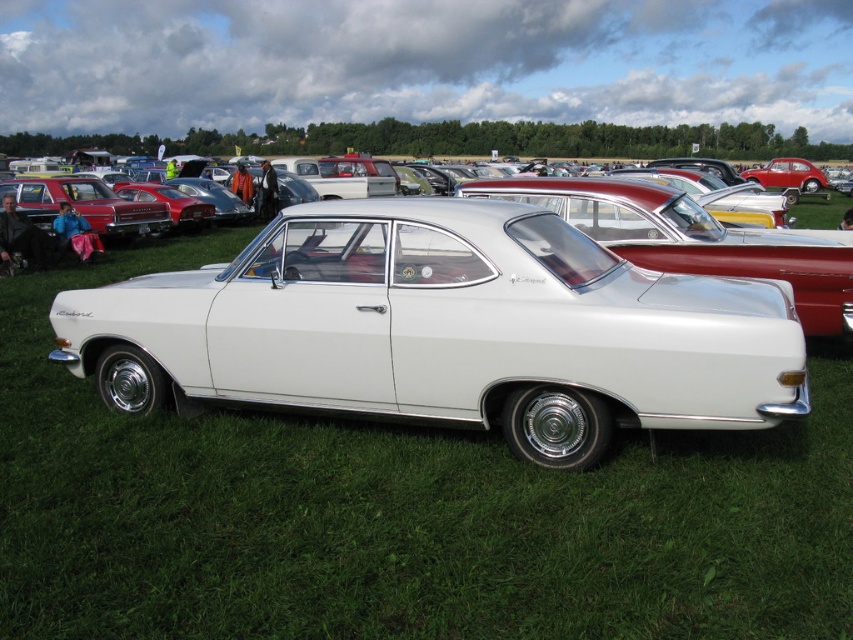
Based on the photo, can you confirm if white glossy car at center is wider than white glossy sedan at center?

Yes.

Between point (242, 276) and point (653, 212), which one is positioned behind?

Positioned behind is point (653, 212).

At what (x,y) coordinates should I click in order to perform the action: click on white glossy car at center. Please return your answer as a coordinate pair (x, y). This screenshot has width=853, height=640. Looking at the image, I should click on (445, 328).

Can you confirm if matte red car at left is positioned above shiny red car at center?

No, matte red car at left is not above shiny red car at center.

Who is more distant from viewer, (132, 202) or (776, 176)?

The point (776, 176) is behind.

Image resolution: width=853 pixels, height=640 pixels. Find the location of `matte red car at left`. matte red car at left is located at coordinates (90, 204).

Can you confirm if white glossy sedan at center is positioned above shiny red car at center?

Actually, white glossy sedan at center is below shiny red car at center.

The height and width of the screenshot is (640, 853). Describe the element at coordinates (689, 240) in the screenshot. I see `white glossy sedan at center` at that location.

Identify the location of white glossy sedan at center. (689, 240).